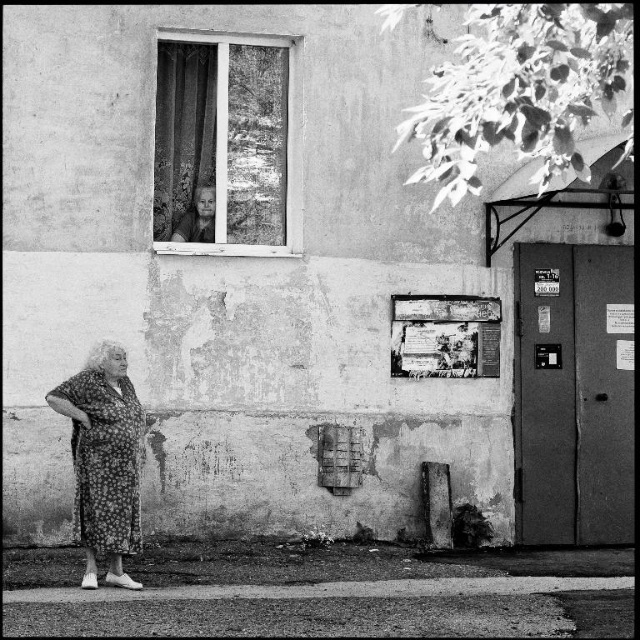
You are standing in front of the weathered building and notice both the wooden frame window at upper center and the floral dress at lower left. Which object is closer to you?

The wooden frame window at upper center is closer to you because it is further to the viewer than the floral dress at lower left.

You are standing in front of the weathered building and want to enter through the door. Which object is closer to you, the wooden frame window at upper center or the smooth asphalt curb at lower center?

The wooden frame window at upper center is closer to you because it is further to the viewer than the smooth asphalt curb at lower center.

You are a photographer trying to capture the scene outside the weathered building. You notice the floral dress at lower left and the smooth asphalt curb at lower center. Which object would appear narrower in your photo?

The floral dress at lower left is thinner than the smooth asphalt curb at lower center, so it would appear narrower in the photo.